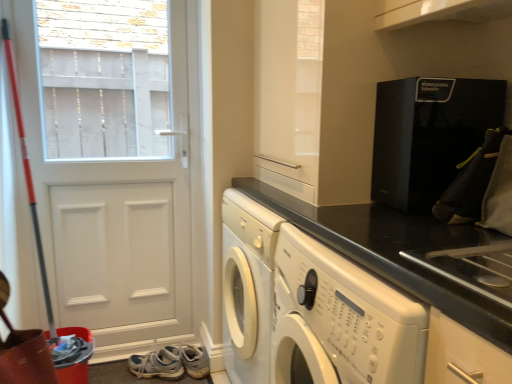
Identify the location of black granite countertop at center. Image resolution: width=512 pixels, height=384 pixels. (395, 252).

Identify the location of white matte door at left. Image resolution: width=512 pixels, height=384 pixels. (116, 164).

Identify the location of black textured coffee machine at upper right. (429, 135).

Is white matte door at left inside white leather shoe at lower left?

No, white matte door at left is not a part of white leather shoe at lower left.

Considering the relative sizes of white leather shoe at lower left and white matte door at left in the image provided, is white leather shoe at lower left shorter than white matte door at left?

Yes.

From the image's perspective, is white leather shoe at lower left above or below white matte door at left?

white leather shoe at lower left is situated lower than white matte door at left in the image.

How many degrees apart are the facing directions of black granite countertop at center and black textured coffee machine at upper right?

They differ by 1.3 degrees in their facing directions.

In the image, is black granite countertop at center on the left side or the right side of black textured coffee machine at upper right?

Based on their positions, black granite countertop at center is located to the left of black textured coffee machine at upper right.

Is black textured coffee machine at upper right at the back of black granite countertop at center?

No, black granite countertop at center is not facing the opposite direction of black textured coffee machine at upper right.

In the scene shown: From the image's perspective, which is above, black granite countertop at center or black textured coffee machine at upper right?

black textured coffee machine at upper right is shown above in the image.

From a real-world perspective, is white leather shoe at lower left below black granite countertop at center?

Indeed, from a real-world perspective, white leather shoe at lower left is positioned beneath black granite countertop at center.

Is white leather shoe at lower left placed right next to black granite countertop at center?

No, white leather shoe at lower left is not touching black granite countertop at center.

The image size is (512, 384). In order to click on countertop that appears in front of the white leather shoe at lower left in this screenshot , I will do `click(395, 252)`.

Is white leather shoe at lower left at the left side of black granite countertop at center?

Indeed, white leather shoe at lower left is positioned on the left side of black granite countertop at center.

Considering the points (156, 306) and (145, 369), which point is behind, point (156, 306) or point (145, 369)?

Positioned behind is point (156, 306).

From the image's perspective, is white matte door at left on white leather shoe at lower left?

Indeed, from the image's perspective, white matte door at left is shown above white leather shoe at lower left.

Do you think white matte door at left is within white leather shoe at lower left, or outside of it?

white matte door at left is not inside white leather shoe at lower left, it's outside.

Are white matte door at left and white leather shoe at lower left beside each other?

No, white matte door at left is not touching white leather shoe at lower left.

I want to click on home appliance above the black granite countertop at center (from the image's perspective), so [429, 135].

Are black textured coffee machine at upper right and black granite countertop at center beside each other?

No, black textured coffee machine at upper right is not in contact with black granite countertop at center.

Is black textured coffee machine at upper right smaller than black granite countertop at center?

Correct, black textured coffee machine at upper right occupies less space than black granite countertop at center.

Could you tell me if black textured coffee machine at upper right is facing black granite countertop at center?

No, black textured coffee machine at upper right is not oriented towards black granite countertop at center.

Can you confirm if black granite countertop at center is smaller than white matte door at left?

Incorrect, black granite countertop at center is not smaller in size than white matte door at left.

From the picture: Who is taller, black granite countertop at center or white matte door at left?

white matte door at left.

Measure the distance from black granite countertop at center to white matte door at left.

black granite countertop at center is 3.33 feet from white matte door at left.

Is point (365, 250) positioned before point (164, 339)?

Yes, it is in front of point (164, 339).

Which of these two, black granite countertop at center or white leather shoe at lower left, is bigger?

Bigger between the two is black granite countertop at center.

How many degrees apart are the facing directions of black granite countertop at center and white leather shoe at lower left?

The angle between the facing direction of black granite countertop at center and the facing direction of white leather shoe at lower left is 130 degrees.

I want to click on shoe below the black granite countertop at center (from a real-world perspective), so click(x=157, y=365).

Is black granite countertop at center surrounding white leather shoe at lower left?

No, black granite countertop at center does not contain white leather shoe at lower left.

Image resolution: width=512 pixels, height=384 pixels. What are the coordinates of `shoe that is behind the white matte door at left` in the screenshot? It's located at (157, 365).

Where is `home appliance positioned vertically above the black granite countertop at center (from a real-world perspective)`? This screenshot has width=512, height=384. home appliance positioned vertically above the black granite countertop at center (from a real-world perspective) is located at coordinates (429, 135).

Which object lies nearer to the anchor point black textured coffee machine at upper right, black granite countertop at center or white leather shoe at lower left?

black granite countertop at center lies closer to black textured coffee machine at upper right than the other object.

From the image, which object appears to be farther from white leather shoe at lower left, black granite countertop at center or black textured coffee machine at upper right?

black textured coffee machine at upper right lies further to white leather shoe at lower left than the other object.

Considering their positions, is white matte door at left positioned further to white leather shoe at lower left than black textured coffee machine at upper right?

black textured coffee machine at upper right is positioned further to the anchor white leather shoe at lower left.

Which object lies nearer to the anchor point black granite countertop at center, white leather shoe at lower left or black textured coffee machine at upper right?

black textured coffee machine at upper right is closer to black granite countertop at center.

From the image, which object appears to be farther from black granite countertop at center, black textured coffee machine at upper right or white leather shoe at lower left?

Among the two, white leather shoe at lower left is located further to black granite countertop at center.

From the image, which object appears to be farther from white matte door at left, white leather shoe at lower left or black textured coffee machine at upper right?

Based on the image, black textured coffee machine at upper right appears to be further to white matte door at left.

Estimate the real-world distances between objects in this image. Which object is closer to white leather shoe at lower left, black textured coffee machine at upper right or white matte door at left?

white matte door at left.

Considering their positions, is black granite countertop at center positioned further to white matte door at left than black textured coffee machine at upper right?

black textured coffee machine at upper right is positioned further to the anchor white matte door at left.

Identify the location of countertop situated between white matte door at left and black textured coffee machine at upper right from left to right. Image resolution: width=512 pixels, height=384 pixels. (395, 252).

The height and width of the screenshot is (384, 512). Identify the location of shoe situated between white matte door at left and black granite countertop at center from left to right. (157, 365).

What are the coordinates of `shoe between white matte door at left and black textured coffee machine at upper right in the horizontal direction` in the screenshot? It's located at (157, 365).

Locate an element on the screen. The height and width of the screenshot is (384, 512). countertop between white leather shoe at lower left and black textured coffee machine at upper right from left to right is located at coordinates (395, 252).